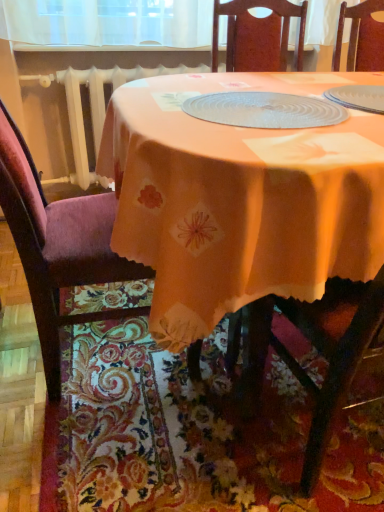
Find the location of a particular element. The height and width of the screenshot is (512, 384). free space in front of velvet purple chair at left is located at coordinates (126, 449).